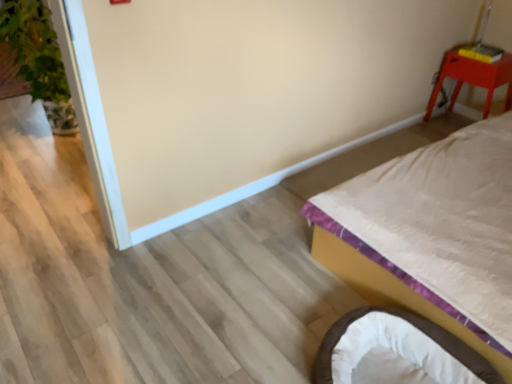
Question: Is green leafy plant at left wider than soft white fabric infant bed at lower right?

Choices:
 (A) yes
 (B) no

Answer: (B)

Question: Does green leafy plant at left have a lesser height compared to soft white fabric infant bed at lower right?

Choices:
 (A) no
 (B) yes

Answer: (A)

Question: From the image's perspective, is green leafy plant at left on soft white fabric infant bed at lower right?

Choices:
 (A) no
 (B) yes

Answer: (B)

Question: Is green leafy plant at left to the right of soft white fabric infant bed at lower right from the viewer's perspective?

Choices:
 (A) no
 (B) yes

Answer: (A)

Question: Would you say green leafy plant at left is a long distance from soft white fabric infant bed at lower right?

Choices:
 (A) yes
 (B) no

Answer: (A)

Question: Does green leafy plant at left lie behind soft white fabric infant bed at lower right?

Choices:
 (A) yes
 (B) no

Answer: (A)

Question: Is the surface of white satin bed at right in direct contact with green leafy plant at left?

Choices:
 (A) yes
 (B) no

Answer: (B)

Question: Is green leafy plant at left inside white satin bed at right?

Choices:
 (A) yes
 (B) no

Answer: (B)

Question: Is white satin bed at right outside of green leafy plant at left?

Choices:
 (A) no
 (B) yes

Answer: (B)

Question: From the image's perspective, is white satin bed at right on green leafy plant at left?

Choices:
 (A) no
 (B) yes

Answer: (A)

Question: Is white satin bed at right taller than green leafy plant at left?

Choices:
 (A) no
 (B) yes

Answer: (A)

Question: Is white satin bed at right behind green leafy plant at left?

Choices:
 (A) no
 (B) yes

Answer: (A)

Question: Is matte red stool at upper right outside white satin bed at right?

Choices:
 (A) no
 (B) yes

Answer: (B)